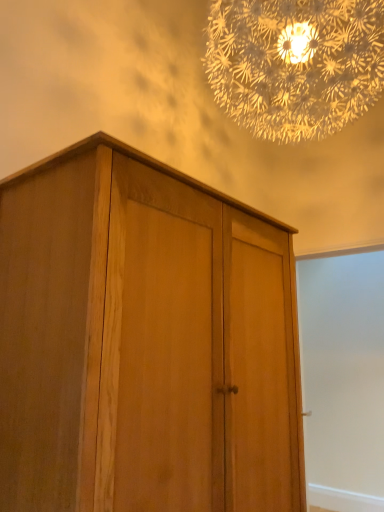
Question: Is natural wood cupboard at center smaller than white matte screen door at right?

Choices:
 (A) yes
 (B) no

Answer: (B)

Question: Is natural wood cupboard at center next to white matte screen door at right and touching it?

Choices:
 (A) yes
 (B) no

Answer: (B)

Question: Is natural wood cupboard at center further to camera compared to white matte screen door at right?

Choices:
 (A) no
 (B) yes

Answer: (A)

Question: From a real-world perspective, is natural wood cupboard at center on white matte screen door at right?

Choices:
 (A) no
 (B) yes

Answer: (B)

Question: Is natural wood cupboard at center not near white matte screen door at right?

Choices:
 (A) no
 (B) yes

Answer: (B)

Question: Does natural wood cupboard at center appear on the right side of white matte screen door at right?

Choices:
 (A) yes
 (B) no

Answer: (B)

Question: Is white matte screen door at right wider than translucent glass chandelier at upper center?

Choices:
 (A) yes
 (B) no

Answer: (B)

Question: Is white matte screen door at right facing away from translucent glass chandelier at upper center?

Choices:
 (A) no
 (B) yes

Answer: (A)

Question: Does white matte screen door at right have a larger size compared to translucent glass chandelier at upper center?

Choices:
 (A) yes
 (B) no

Answer: (B)

Question: From a real-world perspective, is white matte screen door at right on top of translucent glass chandelier at upper center?

Choices:
 (A) yes
 (B) no

Answer: (B)

Question: Is white matte screen door at right outside of translucent glass chandelier at upper center?

Choices:
 (A) yes
 (B) no

Answer: (A)

Question: Is white matte screen door at right further to the viewer compared to translucent glass chandelier at upper center?

Choices:
 (A) no
 (B) yes

Answer: (B)

Question: From the image's perspective, is natural wood cupboard at center beneath translucent glass chandelier at upper center?

Choices:
 (A) yes
 (B) no

Answer: (A)